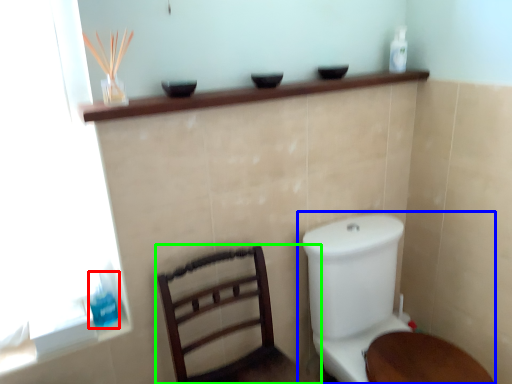
Question: Based on their relative distances, which object is nearer to toiletry (highlighted by a red box)? Choose from toilet (highlighted by a blue box) and furniture (highlighted by a green box).

Choices:
 (A) toilet
 (B) furniture

Answer: (B)